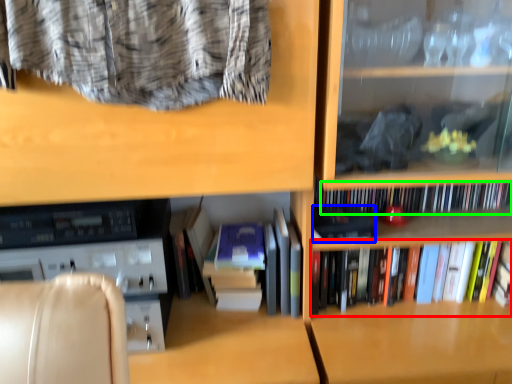
Question: Which object is positioned farthest from book (highlighted by a red box)? Select from paperback book (highlighted by a blue box) and book (highlighted by a green box).

Choices:
 (A) paperback book
 (B) book

Answer: (A)